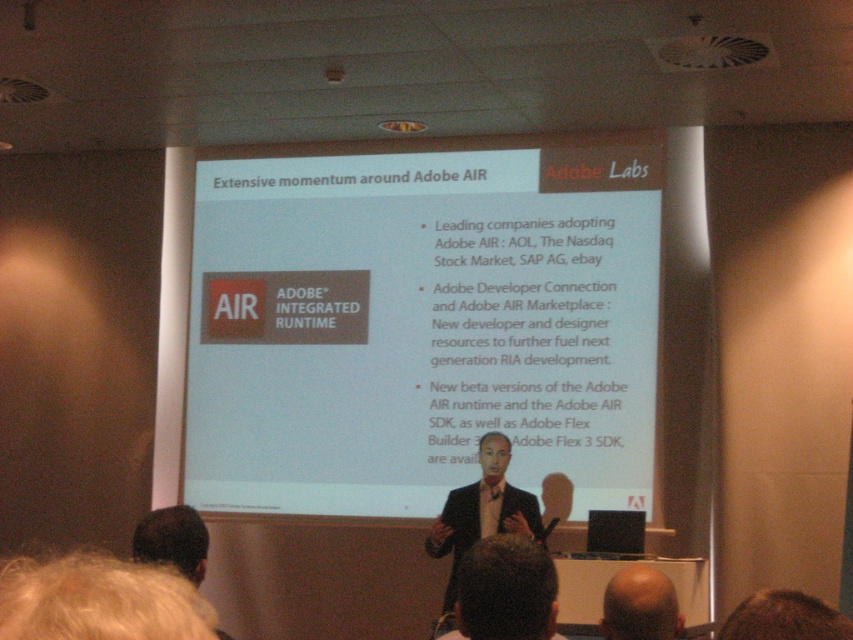
Question: Does dark suit at lower center appear over dark suit at center?

Choices:
 (A) no
 (B) yes

Answer: (B)

Question: Which point is closer to the camera?

Choices:
 (A) [x=490, y=205]
 (B) [x=612, y=602]
 (C) [x=463, y=531]
 (D) [x=534, y=552]

Answer: (D)

Question: Does white paper at center appear under bald head at center?

Choices:
 (A) no
 (B) yes

Answer: (A)

Question: Which object is farther from the camera taking this photo?

Choices:
 (A) white paper at center
 (B) bald head at center
 (C) dark suit at lower center
 (D) dark suit at center

Answer: (A)

Question: Which is nearer to the dark suit at lower center?

Choices:
 (A) dark suit at center
 (B) white paper at center
 (C) bald head at center

Answer: (C)

Question: Can you confirm if dark suit at lower center is positioned to the right of dark suit at center?

Choices:
 (A) yes
 (B) no

Answer: (A)